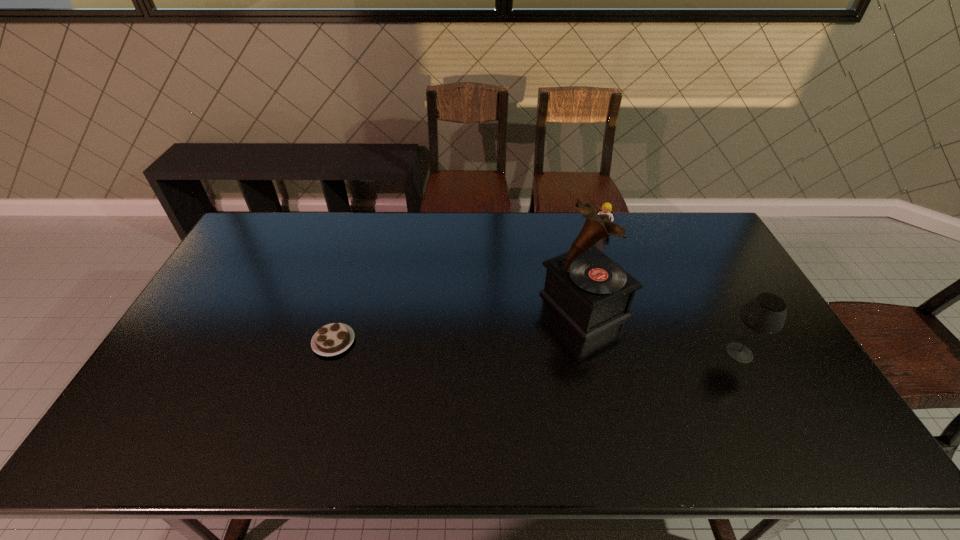
Where is `blank space at the right edge`? The image size is (960, 540). blank space at the right edge is located at coordinates (732, 320).

In the image, there is a desktop. Where is `vacant space at the far left corner`? The height and width of the screenshot is (540, 960). vacant space at the far left corner is located at coordinates (259, 214).

In the image, there is a desktop. Identify the location of free region at the far right corner. (708, 234).

Locate an element on the screen. The height and width of the screenshot is (540, 960). vacant region between the farthest object and the third shortest object is located at coordinates (670, 292).

Locate an element on the screen. This screenshot has width=960, height=540. free space between the chocolate cake and the wineglass is located at coordinates pyautogui.click(x=537, y=347).

Locate an element on the screen. vacant area that lies between the leftmost object and the rightmost object is located at coordinates (537, 347).

The image size is (960, 540). Identify the location of free space between the third shortest object and the phonograph_record. (661, 329).

Locate an element on the screen. The image size is (960, 540). free area in between the farthest object and the shortest object is located at coordinates (468, 286).

Locate an element on the screen. free space between the leftmost object and the wineglass is located at coordinates (537, 347).

Identify the location of free area in between the rightmost object and the farthest object. (670, 292).